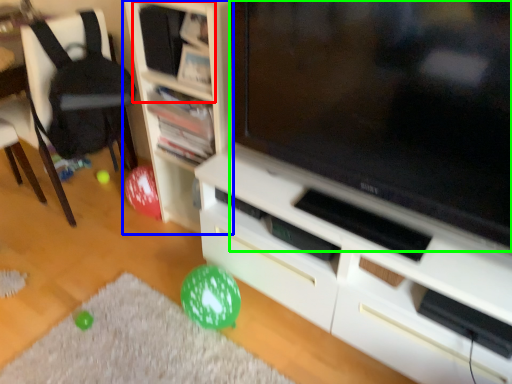
Question: Considering the real-world distances, which object is closest to shelf (highlighted by a red box)? shelf (highlighted by a blue box) or television (highlighted by a green box).

Choices:
 (A) shelf
 (B) television

Answer: (A)